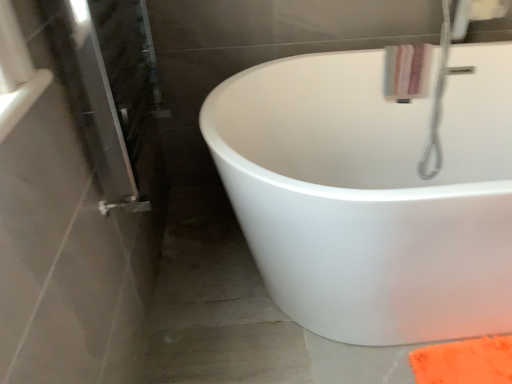
Question: From the image's perspective, relative to striped cotton bath towel at upper right, is white glossy bathtub at center above or below?

Choices:
 (A) above
 (B) below

Answer: (B)

Question: In terms of width, does white glossy bathtub at center look wider or thinner when compared to striped cotton bath towel at upper right?

Choices:
 (A) thin
 (B) wide

Answer: (B)

Question: Is white glossy bathtub at center bigger or smaller than striped cotton bath towel at upper right?

Choices:
 (A) small
 (B) big

Answer: (B)

Question: Is striped cotton bath towel at upper right in front of or behind white glossy bathtub at center in the image?

Choices:
 (A) front
 (B) behind

Answer: (B)

Question: Would you say striped cotton bath towel at upper right is inside or outside white glossy bathtub at center?

Choices:
 (A) inside
 (B) outside

Answer: (A)

Question: Is striped cotton bath towel at upper right taller or shorter than white glossy bathtub at center?

Choices:
 (A) short
 (B) tall

Answer: (A)

Question: In terms of size, does striped cotton bath towel at upper right appear bigger or smaller than white glossy bathtub at center?

Choices:
 (A) small
 (B) big

Answer: (A)